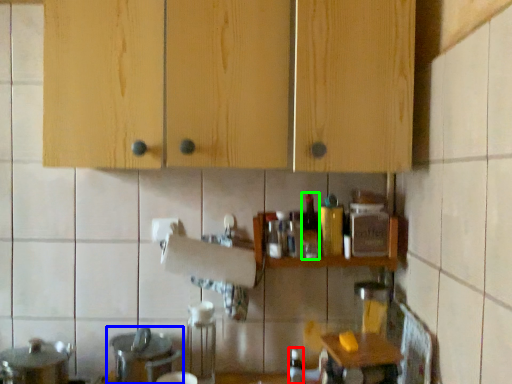
Question: Estimate the real-world distances between objects in this image. Which object is closer to bottle (highlighted by a red box), sink (highlighted by a blue box) or bottle (highlighted by a green box)?

Choices:
 (A) sink
 (B) bottle

Answer: (B)